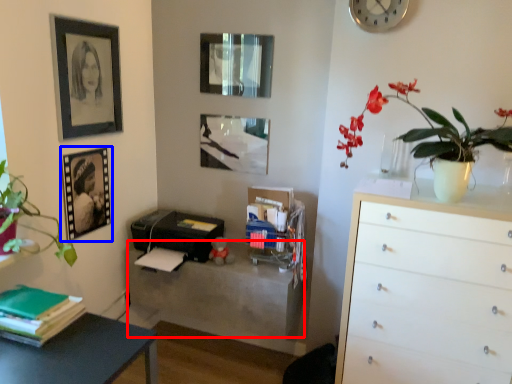
Question: Which point is further to the camera, table (highlighted by a red box) or picture frame (highlighted by a blue box)?

Choices:
 (A) table
 (B) picture frame

Answer: (A)